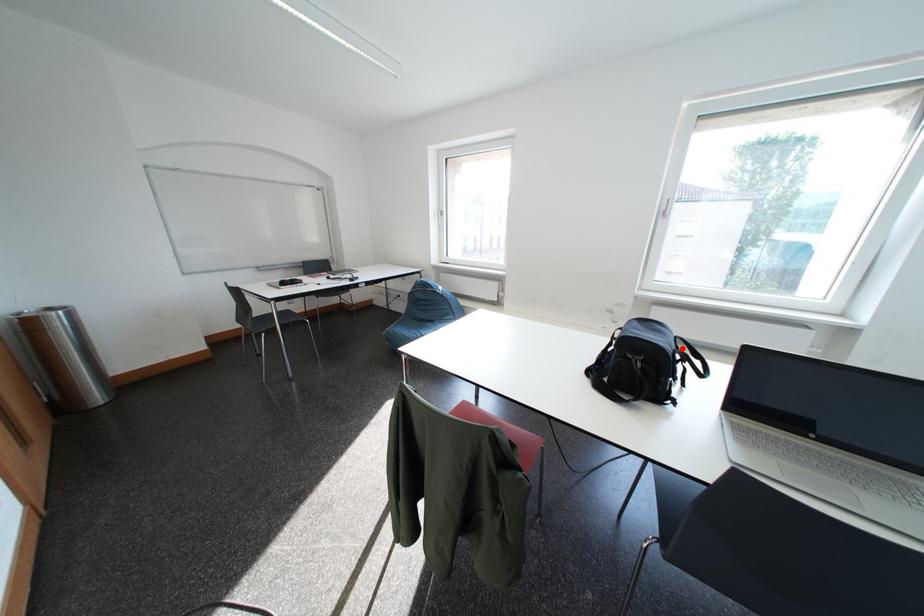
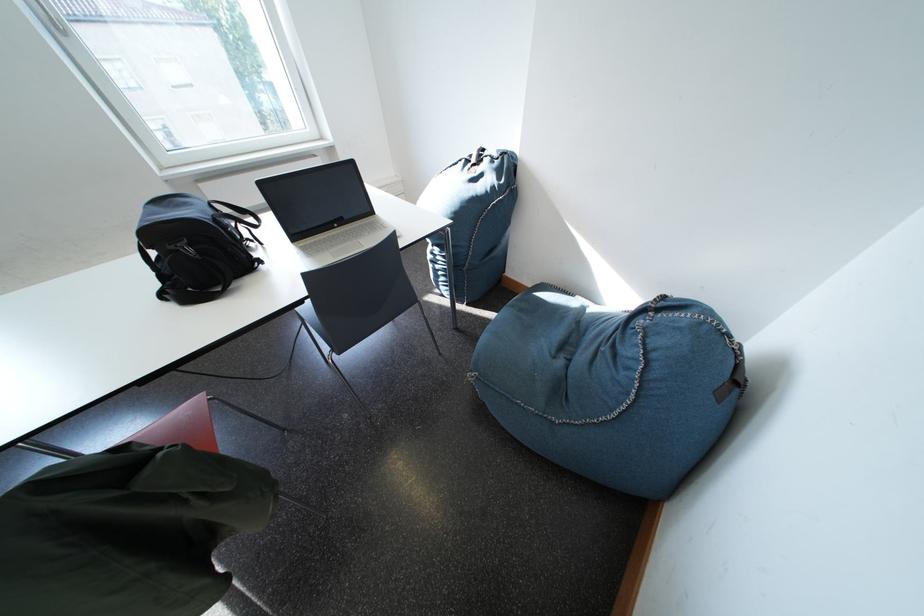
The point at the highlighted location is marked in the first image. Where is the corresponding point in the second image?

(214, 216)